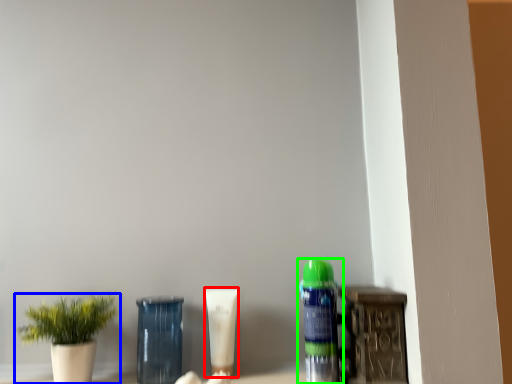
Question: Considering the real-world distances, which object is farthest from product (highlighted by a red box)? houseplant (highlighted by a blue box) or bottle (highlighted by a green box)?

Choices:
 (A) houseplant
 (B) bottle

Answer: (A)